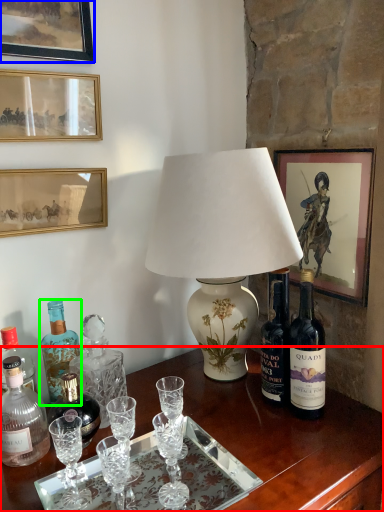
Question: Based on their relative distances, which object is farther from desk (highlighted by a red box)? Choose from picture frame (highlighted by a blue box) and bottle (highlighted by a green box).

Choices:
 (A) picture frame
 (B) bottle

Answer: (A)